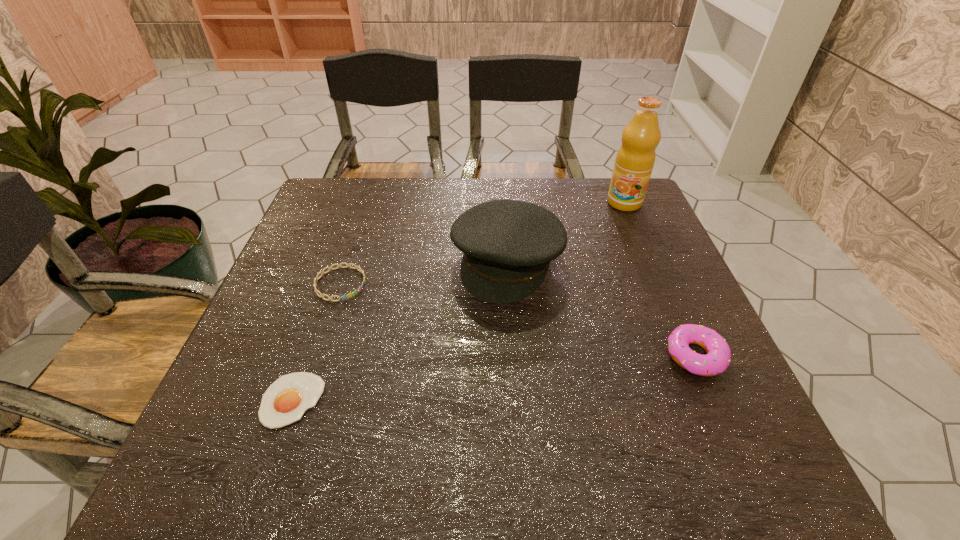
The width and height of the screenshot is (960, 540). In order to click on egg yolk positioned at the left edge in this screenshot , I will do `click(285, 401)`.

The width and height of the screenshot is (960, 540). I want to click on bracelet present at the left edge, so click(x=317, y=278).

Where is `doughnut positioned at the right edge`? The width and height of the screenshot is (960, 540). doughnut positioned at the right edge is located at coordinates (718, 357).

I want to click on fruit juice positioned at the right edge, so click(x=635, y=159).

This screenshot has height=540, width=960. What are the coordinates of `object located in the near left corner section of the desktop` in the screenshot? It's located at (285, 401).

At what (x,y) coordinates should I click in order to perform the action: click on object positioned at the far right corner. Please return your answer as a coordinate pair (x, y). Looking at the image, I should click on (635, 159).

Image resolution: width=960 pixels, height=540 pixels. In the image, there is a desktop. What are the coordinates of `vacant space at the far edge` in the screenshot? It's located at pyautogui.click(x=394, y=178).

Where is `vacant space at the near edge of the desktop`? Image resolution: width=960 pixels, height=540 pixels. vacant space at the near edge of the desktop is located at coordinates (505, 384).

You are a GUI agent. You are given a task and a screenshot of the screen. Output one action in this format:
    pyautogui.click(x=<x>, y=<y>)
    Task: Click on the vacant space at the left edge of the desktop
    
    Given the screenshot: What is the action you would take?
    pyautogui.click(x=324, y=305)

At what (x,y) coordinates should I click in order to perform the action: click on vacant region at the right edge of the desktop. Please return your answer as a coordinate pair (x, y). The width and height of the screenshot is (960, 540). Looking at the image, I should click on (622, 300).